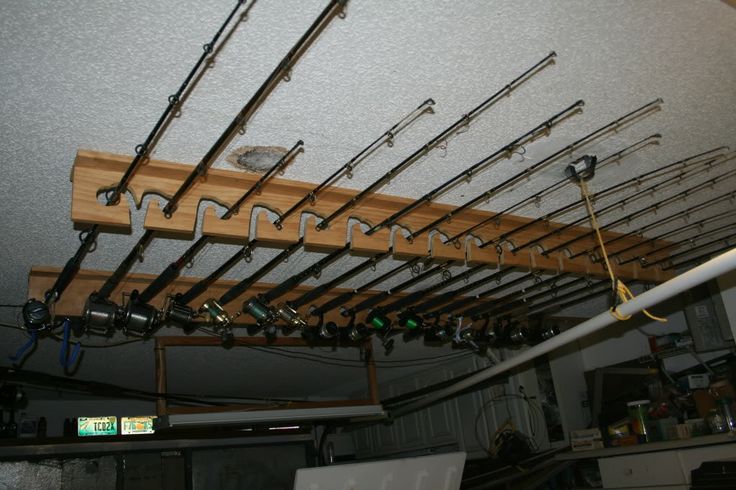
Where is `hole in ceiling`? This screenshot has height=490, width=736. hole in ceiling is located at coordinates (258, 153).